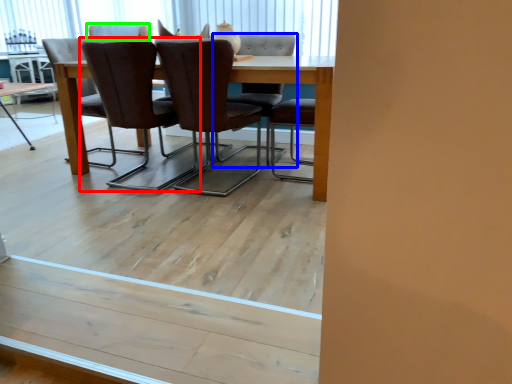
Question: Which is nearer to the chair (highlighted by a red box)? chair (highlighted by a blue box) or chair (highlighted by a green box).

Choices:
 (A) chair
 (B) chair

Answer: (B)